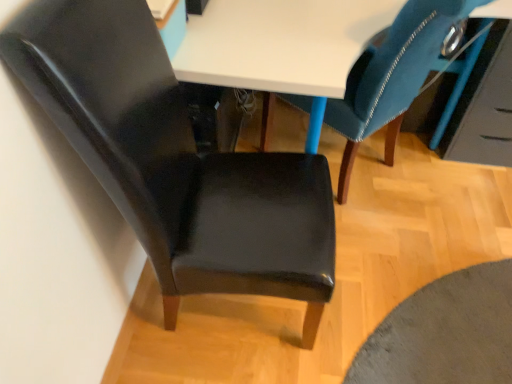
Describe the element at coordinates (484, 106) in the screenshot. The height and width of the screenshot is (384, 512). I see `glossy blue drawer at upper right` at that location.

Find the location of a particular element. glossy blue drawer at upper right is located at coordinates (484, 106).

This screenshot has width=512, height=384. What do you see at coordinates (392, 76) in the screenshot?
I see `velvet blue chair at upper right, which is counted as the second chair, starting from the left` at bounding box center [392, 76].

Where is `matte black chair at left, acting as the first chair starting from the left`? matte black chair at left, acting as the first chair starting from the left is located at coordinates (175, 161).

The height and width of the screenshot is (384, 512). In order to click on glossy blue drawer at upper right in this screenshot , I will do `click(484, 106)`.

Can you see glossy blue drawer at upper right touching velvet blue chair at upper right, the 1th chair when ordered from right to left?

No.

Between glossy blue drawer at upper right and velvet blue chair at upper right, the 1th chair when ordered from right to left, which one has less height?

Standing shorter between the two is glossy blue drawer at upper right.

Is point (484, 143) closer or farther from the camera than point (298, 102)?

Point (484, 143) is positioned closer to the camera compared to point (298, 102).

Which object is positioned more to the left, glossy blue drawer at upper right or velvet blue chair at upper right, which is counted as the second chair, starting from the left?

From the viewer's perspective, velvet blue chair at upper right, which is counted as the second chair, starting from the left, appears more on the left side.

In order to click on chair above the matte black chair at left, marked as the 2th chair in a right-to-left arrangement (from the image's perspective) in this screenshot , I will do `click(392, 76)`.

Is velvet blue chair at upper right, which is counted as the second chair, starting from the left, inside matte black chair at left, acting as the first chair starting from the left?

That's incorrect, velvet blue chair at upper right, which is counted as the second chair, starting from the left, is not inside matte black chair at left, acting as the first chair starting from the left.

Is matte black chair at left, acting as the first chair starting from the left, in front of or behind velvet blue chair at upper right, the 1th chair when ordered from right to left, in the image?

matte black chair at left, acting as the first chair starting from the left, is in front of velvet blue chair at upper right, the 1th chair when ordered from right to left.

From the image's perspective, is matte black chair at left, marked as the 2th chair in a right-to-left arrangement, on glossy blue drawer at upper right?

No, from the image's perspective, matte black chair at left, marked as the 2th chair in a right-to-left arrangement, is not above glossy blue drawer at upper right.

Can you confirm if matte black chair at left, marked as the 2th chair in a right-to-left arrangement, is smaller than glossy blue drawer at upper right?

No.

Is matte black chair at left, acting as the first chair starting from the left, placed right next to glossy blue drawer at upper right?

There is a gap between matte black chair at left, acting as the first chair starting from the left, and glossy blue drawer at upper right.

Is matte black chair at left, acting as the first chair starting from the left, oriented towards glossy blue drawer at upper right?

No, matte black chair at left, acting as the first chair starting from the left, is not facing towards glossy blue drawer at upper right.

In terms of height, does velvet blue chair at upper right, which is counted as the second chair, starting from the left, look taller or shorter compared to glossy blue drawer at upper right?

In the image, velvet blue chair at upper right, which is counted as the second chair, starting from the left, appears to be taller than glossy blue drawer at upper right.

Considering the positions of objects velvet blue chair at upper right, the 1th chair when ordered from right to left, and glossy blue drawer at upper right in the image provided, who is behind, velvet blue chair at upper right, the 1th chair when ordered from right to left, or glossy blue drawer at upper right?

glossy blue drawer at upper right is behind.

Based on the photo, which is closer to the camera, [369,90] or [470,76]?

The point [369,90] is closer to the camera.

Between velvet blue chair at upper right, the 1th chair when ordered from right to left, and glossy blue drawer at upper right, which one has smaller size?

glossy blue drawer at upper right.

Does point (369, 80) appear closer or farther from the camera than point (318, 317)?

Point (369, 80).

Does velvet blue chair at upper right, the 1th chair when ordered from right to left, have a lesser width compared to matte black chair at left, marked as the 2th chair in a right-to-left arrangement?

Incorrect, the width of velvet blue chair at upper right, the 1th chair when ordered from right to left, is not less than that of matte black chair at left, marked as the 2th chair in a right-to-left arrangement.

Is velvet blue chair at upper right, which is counted as the second chair, starting from the left, positioned with its back to matte black chair at left, acting as the first chair starting from the left?

velvet blue chair at upper right, which is counted as the second chair, starting from the left, does not have its back to matte black chair at left, acting as the first chair starting from the left.

Where is `chair behind the matte black chair at left, marked as the 2th chair in a right-to-left arrangement`? The image size is (512, 384). chair behind the matte black chair at left, marked as the 2th chair in a right-to-left arrangement is located at coordinates (392, 76).

Is point (485, 126) closer or farther from the camera than point (232, 162)?

Point (485, 126).

Is glossy blue drawer at upper right smaller than matte black chair at left, marked as the 2th chair in a right-to-left arrangement?

Correct, glossy blue drawer at upper right occupies less space than matte black chair at left, marked as the 2th chair in a right-to-left arrangement.

Is glossy blue drawer at upper right facing towards matte black chair at left, marked as the 2th chair in a right-to-left arrangement?

No, glossy blue drawer at upper right is not turned towards matte black chair at left, marked as the 2th chair in a right-to-left arrangement.

Is glossy blue drawer at upper right taller or shorter than matte black chair at left, marked as the 2th chair in a right-to-left arrangement?

Clearly, glossy blue drawer at upper right is shorter compared to matte black chair at left, marked as the 2th chair in a right-to-left arrangement.

Where is `drawer that appears behind the velvet blue chair at upper right, the 1th chair when ordered from right to left`? drawer that appears behind the velvet blue chair at upper right, the 1th chair when ordered from right to left is located at coordinates (484, 106).

The image size is (512, 384). I want to click on chair on the left of velvet blue chair at upper right, the 1th chair when ordered from right to left, so click(175, 161).

When comparing their distances from glossy blue drawer at upper right, does matte black chair at left, marked as the 2th chair in a right-to-left arrangement, or velvet blue chair at upper right, the 1th chair when ordered from right to left, seem further?

Based on the image, matte black chair at left, marked as the 2th chair in a right-to-left arrangement, appears to be further to glossy blue drawer at upper right.

Looking at the image, which one is located further to velvet blue chair at upper right, the 1th chair when ordered from right to left, glossy blue drawer at upper right or matte black chair at left, acting as the first chair starting from the left?

The object further to velvet blue chair at upper right, the 1th chair when ordered from right to left, is matte black chair at left, acting as the first chair starting from the left.

Based on their spatial positions, is glossy blue drawer at upper right or velvet blue chair at upper right, which is counted as the second chair, starting from the left, further from matte black chair at left, acting as the first chair starting from the left?

glossy blue drawer at upper right is further to matte black chair at left, acting as the first chair starting from the left.

Considering their positions, is velvet blue chair at upper right, the 1th chair when ordered from right to left, positioned closer to glossy blue drawer at upper right than matte black chair at left, marked as the 2th chair in a right-to-left arrangement?

velvet blue chair at upper right, the 1th chair when ordered from right to left, is positioned closer to the anchor glossy blue drawer at upper right.

From the image, which object appears to be farther from matte black chair at left, acting as the first chair starting from the left, velvet blue chair at upper right, which is counted as the second chair, starting from the left, or glossy blue drawer at upper right?

glossy blue drawer at upper right is further to matte black chair at left, acting as the first chair starting from the left.

Based on their spatial positions, is matte black chair at left, marked as the 2th chair in a right-to-left arrangement, or glossy blue drawer at upper right further from velvet blue chair at upper right, the 1th chair when ordered from right to left?

matte black chair at left, marked as the 2th chair in a right-to-left arrangement, is positioned further to the anchor velvet blue chair at upper right, the 1th chair when ordered from right to left.

At what (x,y) coordinates should I click in order to perform the action: click on chair situated between matte black chair at left, acting as the first chair starting from the left, and glossy blue drawer at upper right from left to right. Please return your answer as a coordinate pair (x, y). Looking at the image, I should click on (392, 76).